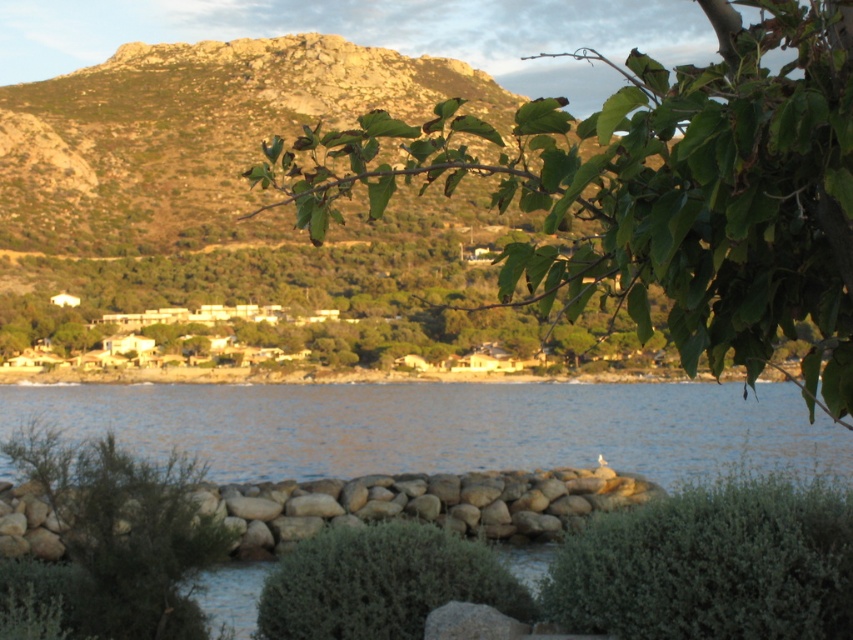
You are an artist sketching this coastal landscape. You want to draw the green leafy branch at upper center accurately. Where exactly should you place it on your canvas?

The green leafy branch at upper center should be placed at point coordinates (657, 193) on your canvas.

You are a hiker who wants to take a shortcut through the bushes. You see the green leafy bush at lower center and the green fuzzy bush at center. Which bush would you need to go around because it is larger?

The green leafy bush at lower center is bigger than the green fuzzy bush at center, so you would need to go around the green leafy bush at lower center.

You are standing on the rocky shoreline and looking towards the water. Which object, the green leafy branch at upper center or the green fuzzy bush at center, is positioned to the right side of the other?

The green leafy branch at upper center is positioned to the right of the green fuzzy bush at center.